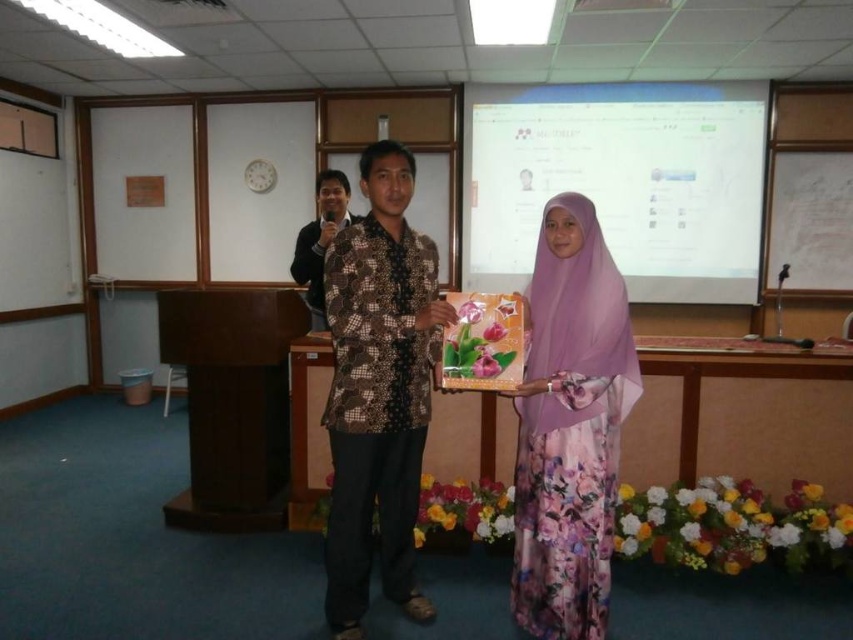
Is floral-patterned dress at center shorter than batik shirt at center?

No, floral-patterned dress at center is not shorter than batik shirt at center.

Looking at this image, who is shorter, floral-patterned dress at center or batik shirt at center?

Standing shorter between the two is batik shirt at center.

This screenshot has width=853, height=640. Describe the element at coordinates (572, 419) in the screenshot. I see `floral-patterned dress at center` at that location.

Identify the location of floral-patterned dress at center. The height and width of the screenshot is (640, 853). (572, 419).

Is point (585, 451) positioned after point (355, 605)?

No, (585, 451) is closer to viewer.

Locate an element on the screen. This screenshot has width=853, height=640. floral-patterned dress at center is located at coordinates (572, 419).

Which is behind, point (546, 531) or point (329, 600)?

Positioned behind is point (329, 600).

The height and width of the screenshot is (640, 853). What are the coordinates of `floral-patterned dress at center` in the screenshot? It's located at (572, 419).

Is purple floral dress at center to the right of batik shirt at center from the viewer's perspective?

Yes, purple floral dress at center is to the right of batik shirt at center.

Describe the element at coordinates (569, 426) in the screenshot. This screenshot has height=640, width=853. I see `purple floral dress at center` at that location.

What are the coordinates of `purple floral dress at center` in the screenshot? It's located at (569, 426).